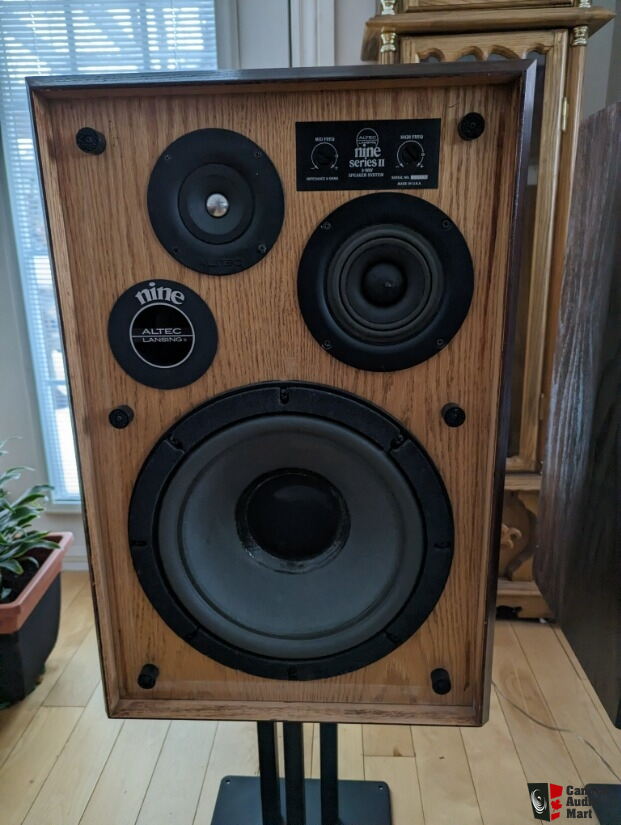
You are a GUI agent. You are given a task and a screenshot of the screen. Output one action in this format:
    pyautogui.click(x=<x>, y=<y>)
    Task: Click on the base of speaker stand
    The width and height of the screenshot is (621, 825).
    Given the screenshot: What is the action you would take?
    pyautogui.click(x=223, y=779), pyautogui.click(x=372, y=792), pyautogui.click(x=225, y=818), pyautogui.click(x=377, y=813)